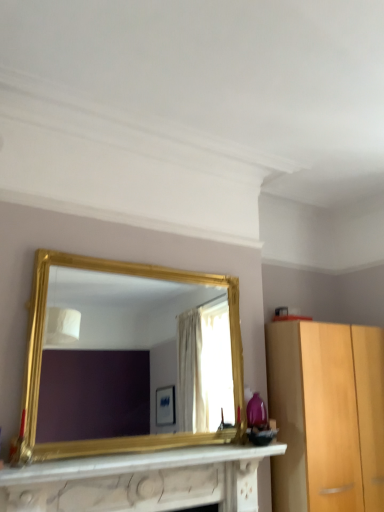
At what (x,y) coordinates should I click in order to perform the action: click on white marble fireplace at lower center. Please return your answer as a coordinate pair (x, y). Image resolution: width=384 pixels, height=512 pixels. Looking at the image, I should click on (140, 481).

Describe the element at coordinates (140, 481) in the screenshot. I see `white marble fireplace at lower center` at that location.

This screenshot has height=512, width=384. Find the location of `gold/gilded mirror at center`. gold/gilded mirror at center is located at coordinates (132, 355).

Describe the element at coordinates (132, 355) in the screenshot. Image resolution: width=384 pixels, height=512 pixels. I see `gold/gilded mirror at center` at that location.

Where is `white marble fireplace at lower center`? The image size is (384, 512). white marble fireplace at lower center is located at coordinates (140, 481).

Consider the image. Can you confirm if gold/gilded mirror at center is positioned to the left of white marble fireplace at lower center?

No, gold/gilded mirror at center is not to the left of white marble fireplace at lower center.

Does gold/gilded mirror at center come behind white marble fireplace at lower center?

Yes, it is behind white marble fireplace at lower center.

Is point (77, 303) closer to camera compared to point (171, 464)?

No, (77, 303) is behind (171, 464).

From the image's perspective, would you say gold/gilded mirror at center is positioned over white marble fireplace at lower center?

Correct, gold/gilded mirror at center appears higher than white marble fireplace at lower center in the image.

From a real-world perspective, which is physically below, gold/gilded mirror at center or white marble fireplace at lower center?

white marble fireplace at lower center, from a real-world perspective.

Which object is wider, gold/gilded mirror at center or white marble fireplace at lower center?

white marble fireplace at lower center.

In the scene shown: Is gold/gilded mirror at center taller or shorter than white marble fireplace at lower center?

gold/gilded mirror at center is taller than white marble fireplace at lower center.

Is gold/gilded mirror at center bigger than white marble fireplace at lower center?

Yes.

From the picture: Is white marble fireplace at lower center inside gold/gilded mirror at center?

No.

Consider the image. Is the surface of gold/gilded mirror at center in direct contact with white marble fireplace at lower center?

gold/gilded mirror at center is not next to white marble fireplace at lower center, and they're not touching.

Could you tell me if gold/gilded mirror at center is turned towards white marble fireplace at lower center?

No, gold/gilded mirror at center is not facing towards white marble fireplace at lower center.

Measure the distance between gold/gilded mirror at center and white marble fireplace at lower center.

gold/gilded mirror at center is 2.96 meters away from white marble fireplace at lower center.

This screenshot has width=384, height=512. What are the coordinates of `mirror above the white marble fireplace at lower center (from the image's perspective)` in the screenshot? It's located at (132, 355).

Is white marble fireplace at lower center at the left side of gold/gilded mirror at center?

Yes.

Which object is closer to the camera taking this photo, white marble fireplace at lower center or gold/gilded mirror at center?

Positioned in front is white marble fireplace at lower center.

Considering the positions of point (107, 498) and point (224, 351), is point (107, 498) closer or farther from the camera than point (224, 351)?

Clearly, point (107, 498) is closer to the camera than point (224, 351).

From the image's perspective, is white marble fireplace at lower center located above or below gold/gilded mirror at center?

Clearly, from the image's perspective, white marble fireplace at lower center is below gold/gilded mirror at center.

From a real-world perspective, is white marble fireplace at lower center under gold/gilded mirror at center?

Yes.

Does white marble fireplace at lower center have a lesser width compared to gold/gilded mirror at center?

No.

Considering the relative sizes of white marble fireplace at lower center and gold/gilded mirror at center in the image provided, is white marble fireplace at lower center shorter than gold/gilded mirror at center?

Yes.

Can you confirm if white marble fireplace at lower center is bigger than gold/gilded mirror at center?

No, white marble fireplace at lower center is not bigger than gold/gilded mirror at center.

Is gold/gilded mirror at center inside white marble fireplace at lower center?

No, gold/gilded mirror at center is located outside of white marble fireplace at lower center.

Does white marble fireplace at lower center touch gold/gilded mirror at center?

No, white marble fireplace at lower center is not in contact with gold/gilded mirror at center.

Could you tell me if white marble fireplace at lower center is facing gold/gilded mirror at center?

No, white marble fireplace at lower center is not turned towards gold/gilded mirror at center.

How many degrees apart are the facing directions of white marble fireplace at lower center and gold/gilded mirror at center?

The facing directions of white marble fireplace at lower center and gold/gilded mirror at center are 1.94 degrees apart.

You are a GUI agent. You are given a task and a screenshot of the screen. Output one action in this format:
    pyautogui.click(x=<x>, y=<y>)
    Task: Click on the vanity in front of the gold/gilded mirror at center
    The image size is (384, 512).
    Given the screenshot: What is the action you would take?
    pyautogui.click(x=140, y=481)

Locate an element on the screen. vanity in front of the gold/gilded mirror at center is located at coordinates (140, 481).

I want to click on vanity located on the left of gold/gilded mirror at center, so [x=140, y=481].